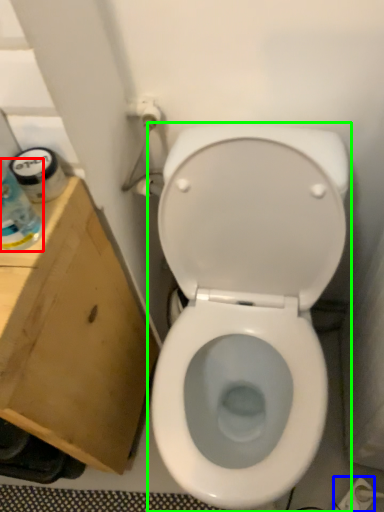
Question: Which object is positioned closest to bottle (highlighted by a red box)? Select from electric outlet (highlighted by a blue box) and toilet (highlighted by a green box).

Choices:
 (A) electric outlet
 (B) toilet

Answer: (B)